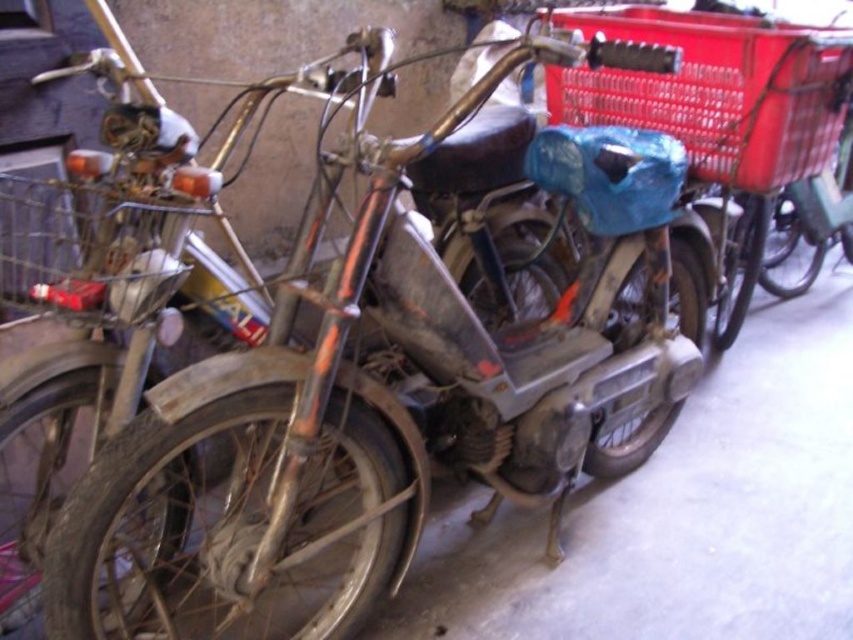
You are organizing items in a garage and need to place a heavy tool. You see the red plastic basket at upper right and the metallic wire basket at left. Which basket is closer to you?

The red plastic basket at upper right is closer to you because the metallic wire basket at left is behind it.

You have a 3.5 feet wide box that needs to be placed between the red plastic basket at upper right and the metallic wire basket at left. Can the box fit in the space between them?

The red plastic basket at upper right and metallic wire basket at left are 4.06 feet apart. Since the box is 3.5 feet wide, it can fit in the space between them as the distance is greater than the box width.